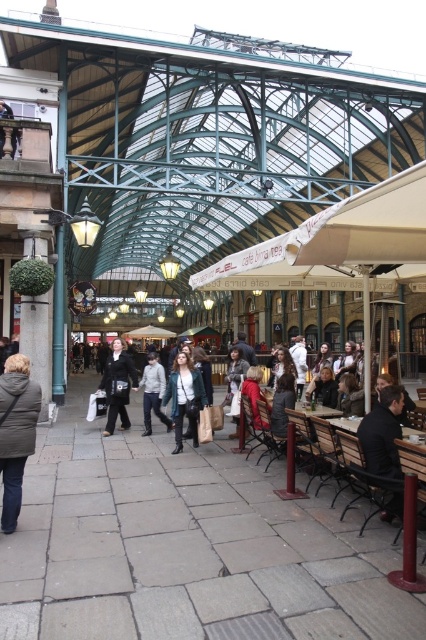
Between point (11, 384) and point (402, 509), which one is positioned behind?

Positioned behind is point (402, 509).

Describe the element at coordinates (16, 433) in the screenshot. I see `gray puffy coat at lower left` at that location.

Find the location of a particular element. This screenshot has height=640, width=426. gray puffy coat at lower left is located at coordinates (16, 433).

Can you confirm if dark brown leather jacket at lower right is positioned to the right of light gray jacket at center?

Correct, you'll find dark brown leather jacket at lower right to the right of light gray jacket at center.

Based on the photo, is dark brown leather jacket at lower right shorter than light gray jacket at center?

Correct, dark brown leather jacket at lower right is not as tall as light gray jacket at center.

Find the location of a particular element. This screenshot has width=426, height=640. dark brown leather jacket at lower right is located at coordinates (382, 433).

I want to click on dark brown leather jacket at lower right, so click(382, 433).

The width and height of the screenshot is (426, 640). In order to click on gray puffy coat at lower left in this screenshot , I will do `click(16, 433)`.

Is gray puffy coat at lower left taller than dark brown leather jacket at center?

No.

The width and height of the screenshot is (426, 640). Describe the element at coordinates (16, 433) in the screenshot. I see `gray puffy coat at lower left` at that location.

You are a GUI agent. You are given a task and a screenshot of the screen. Output one action in this format:
    pyautogui.click(x=<x>, y=<y>)
    Task: Click on the gray puffy coat at lower left
    The width and height of the screenshot is (426, 640).
    Given the screenshot: What is the action you would take?
    pyautogui.click(x=16, y=433)